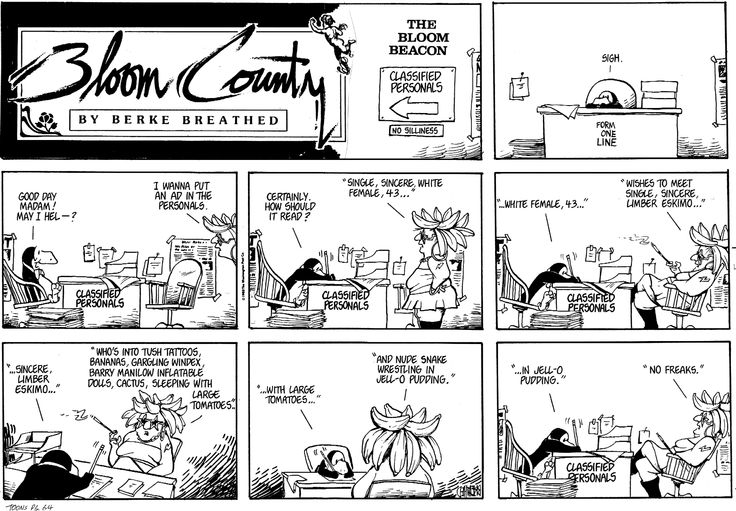
Locate an element on the screen. panel is located at coordinates (350, 69), (572, 16), (576, 228), (364, 216), (95, 206), (230, 458), (349, 396), (592, 386).